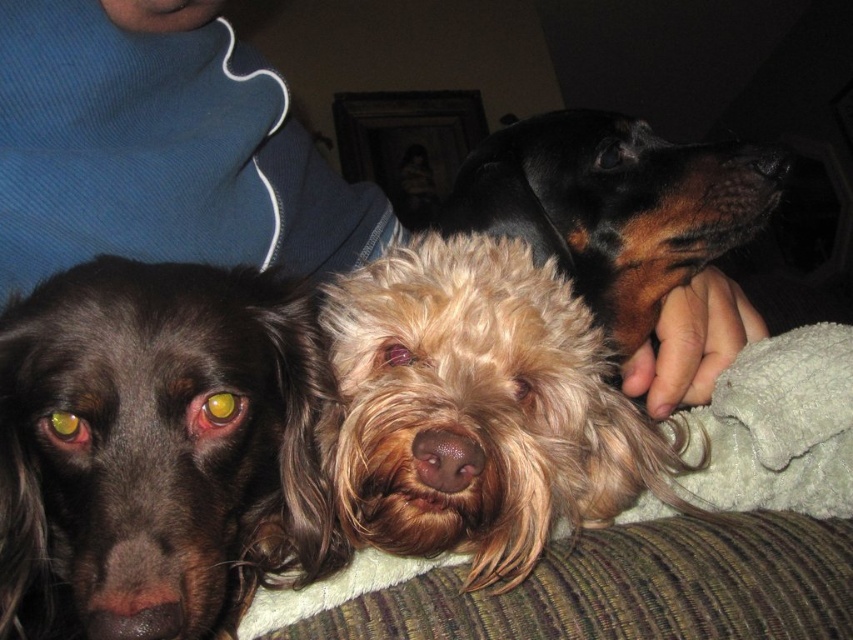
You are a dog owner who wants to fit both the brown shaggy dog at center and the fuzzy brown dog at center into a dog bed that can accommodate the wider of the two. Which dog should you choose to determine the minimum width required for the bed?

The fuzzy brown dog at center is wider than the brown shaggy dog at center, so you should base the minimum width of the bed on the fuzzy brown dog at center.

You are looking at the image of two dogs on a couch. The dogs are labeled as the brown shaggy dog at center and the fuzzy brown dog at center. Which dog is positioned to the left of the other?

The brown shaggy dog at center is to the left of the fuzzy brown dog at center.

What are the coordinates of the brown shaggy dog at center?

The brown shaggy dog at center is located at point (161,445).